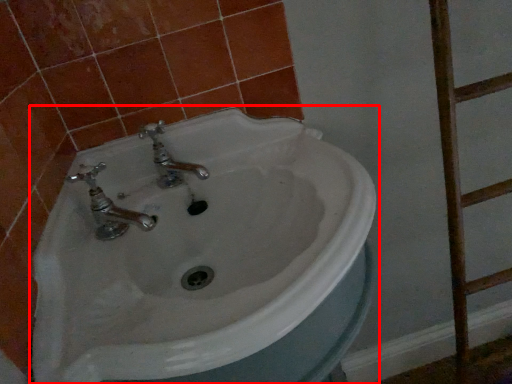
Question: Where is sink (annotated by the red box) located in relation to ladder in the image?

Choices:
 (A) right
 (B) left

Answer: (B)